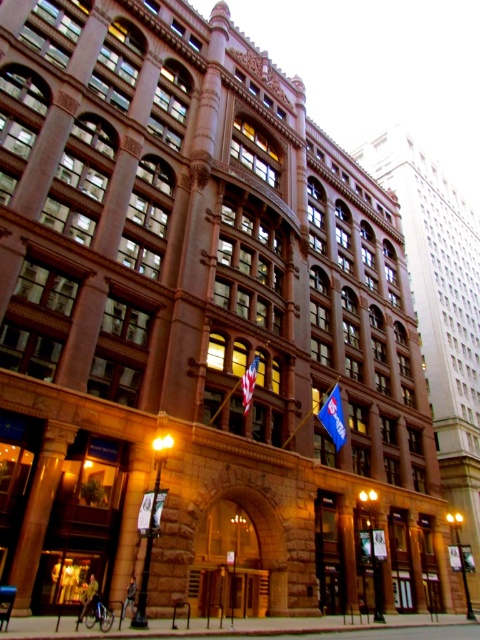
Consider the image. You are standing in front of the grand historic building and want to take a photo of both the brown stone pillar at lower left and the blue fabric flag at lower right. Which object should you adjust your camera angle to include first if you need to frame them both in the shot?

The brown stone pillar at lower left is closer to the viewer than the blue fabric flag at lower right, so you should adjust your camera angle to include the brown stone pillar at lower left first to ensure both are in frame.

You are standing at the entrance of the grand historic building and want to know how far the brown stone pillar at lower left is from your current position. Can you determine the distance?

The brown stone pillar at lower left is 116.48 feet away from the camera, so the distance from your current position at the entrance to the brown stone pillar at lower left is 116.48 feet.

You are standing at the entrance of the historic building and want to walk directly to the blue fabric flag at lower right. There is a brown stone pillar at lower left in your path. Given that you can only move in straight lines and your path must avoid the pillar, what is the minimum distance you need to walk to reach the flag?

The minimum distance you need to walk is approximately 29.67 meters, as the brown stone pillar at lower left is 29.67 meters away from the blue fabric flag at lower right, and moving in a straight line towards the flag while avoiding the pillar would require navigating around it, but the direct distance remains the same. However, since the pillar is in the path, the actual path would be longer than the straight line distance. The problem states that you can only move in straight lines and must avoid the p